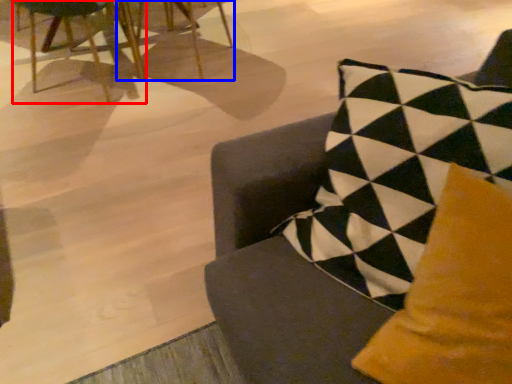
Question: Which of the following is the farthest to the observer, chair (highlighted by a red box) or chair (highlighted by a blue box)?

Choices:
 (A) chair
 (B) chair

Answer: (B)